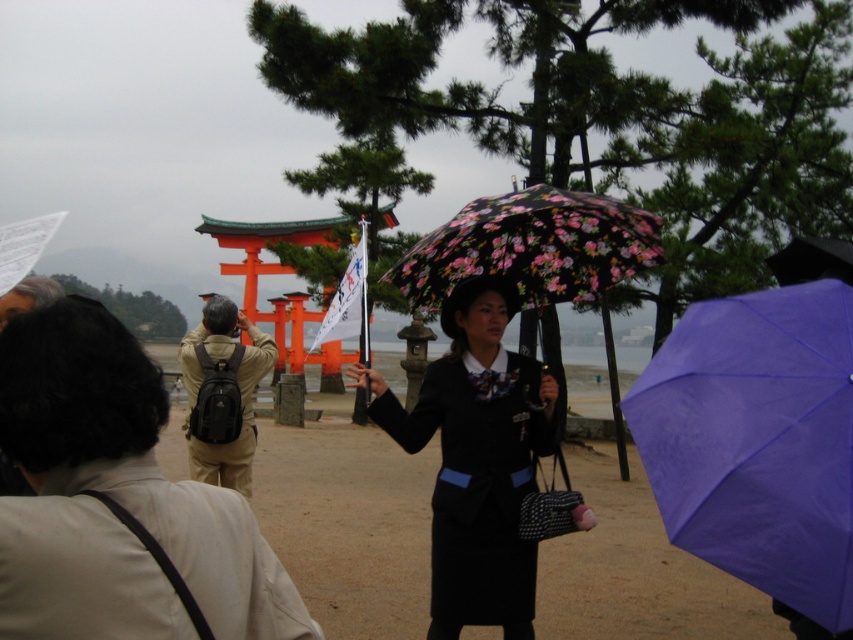
Looking at this image, is the position of black fabric dress at center less distant than that of floral-patterned fabric umbrella at center?

That is False.

Does black fabric dress at center have a lesser height compared to floral-patterned fabric umbrella at center?

No, black fabric dress at center is not shorter than floral-patterned fabric umbrella at center.

Describe the element at coordinates (476, 460) in the screenshot. This screenshot has width=853, height=640. I see `black fabric dress at center` at that location.

Locate an element on the screen. The image size is (853, 640). black fabric dress at center is located at coordinates (476, 460).

Can you confirm if khaki fabric pants at center is positioned above purple matte umbrella at center?

Yes.

Is point (70, 472) farther from camera compared to point (828, 563)?

That is False.

Identify the location of khaki fabric pants at center. (117, 500).

Does khaki fabric pants at center appear over floral-patterned fabric umbrella at center?

No, khaki fabric pants at center is not above floral-patterned fabric umbrella at center.

Between point (140, 561) and point (462, 243), which one is positioned behind?

The point (462, 243) is more distant.

This screenshot has height=640, width=853. Identify the location of khaki fabric pants at center. [117, 500].